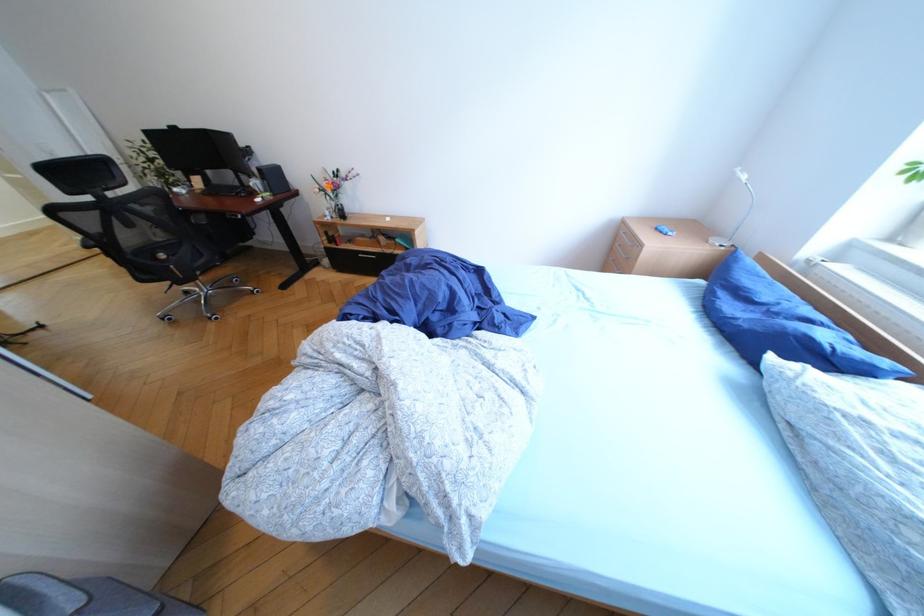
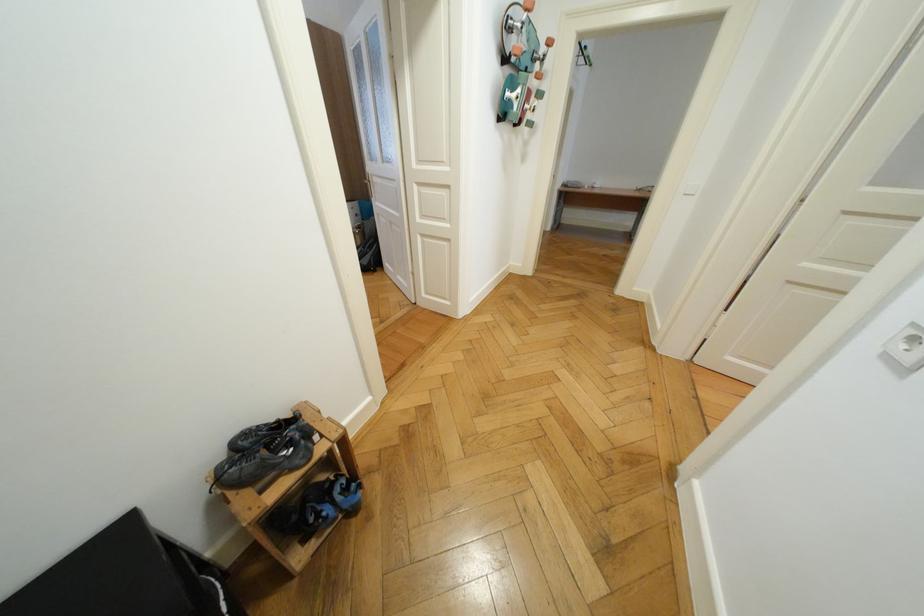
Question: I am providing you with two images of the same scene from different viewpoints. After the viewpoint changes to image2, which objects are now occluded?

Choices:
 (A) white light switch
 (B) black handle tool
 (C) black drawer handle
 (D) blue and black shoe

Answer: (C)